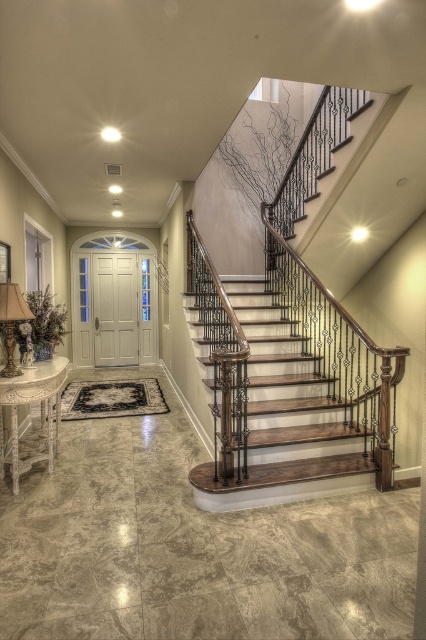
You are a delivery person holding a package that requires a 6.5 feet clearance to maneuver. You need to move from the entrance to the matte gold lamp at lower left, passing by the wooden stairs at center. Can you navigate this path without hitting the package against anything?

The distance between wooden stairs at center and matte gold lamp at lower left is 6.65 feet, which is just enough for the package requiring 6.5 feet clearance. You can navigate the path safely.

You are standing in the foyer and need to move from the matte gold lamp at lower left to the wooden stairs at center. Which direction should you move to reach the stairs?

The wooden stairs at center is positioned on the right side of the matte gold lamp at lower left, so you should move to the right to reach the stairs.